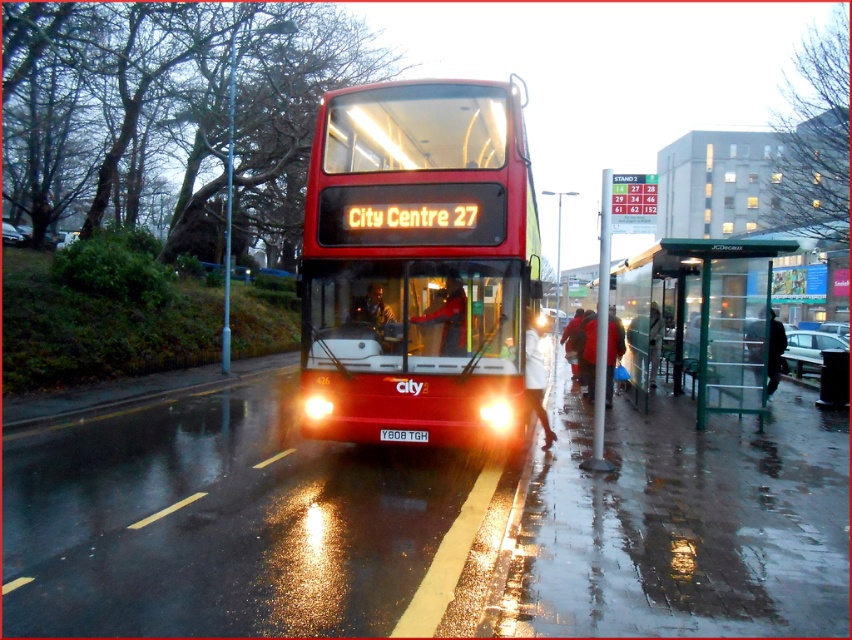
You are a passenger waiting at the bus stop. You have a white matte coat at lower center and notice the green transparent bus stop at right. Which object is higher in this scene?

The green transparent bus stop at right is higher than the white matte coat at lower center.

You are a delivery person with a 1.8 meters tall package. You need to place it under the green transparent bus stop at right without it touching the white matte coat at lower center. Is this possible?

The green transparent bus stop at right is taller than the white matte coat at lower center. Since the package is 1.8 meters tall, it can be placed under the bus stop as long as it doesn not come into contact with the coat, which is shorter and located at the lower center.

You are a pedestrian trying to cross the road in front of the shiny red bus at center and the red leather jacket at center. Which object is closer to the road surface?

The shiny red bus at center is closer to the road surface since it is thinner than the red leather jacket at center, indicating it has a smaller width and likely sits lower to the ground.